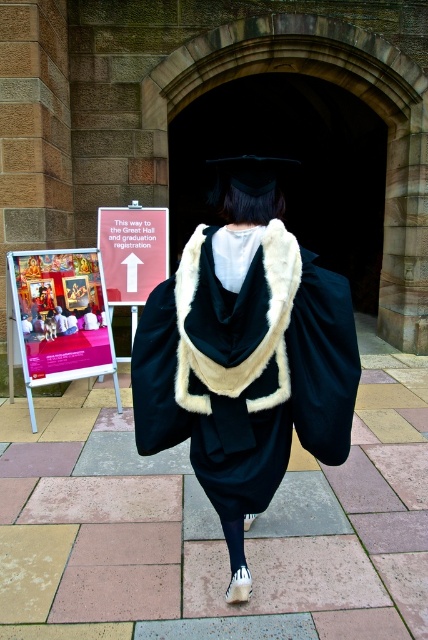
From the picture: Is matte black graduation gown at center above matte pink fabric poster at left?

No.

Who is positioned more to the left, matte black graduation gown at center or matte pink fabric poster at left?

From the viewer's perspective, matte pink fabric poster at left appears more on the left side.

Does point (243, 312) come behind point (30, 269)?

No, it is in front of (30, 269).

The image size is (428, 640). In order to click on matte black graduation gown at center in this screenshot , I will do `click(246, 355)`.

Is matte pink fabric poster at left closer to the viewer compared to white paper sign at center?

Yes, it is in front of white paper sign at center.

Who is shorter, matte pink fabric poster at left or white paper sign at center?

With less height is white paper sign at center.

Which is behind, point (51, 300) or point (121, 280)?

The point (121, 280) is behind.

Find the location of `matte pink fabric poster at left`. matte pink fabric poster at left is located at coordinates (59, 317).

Consider the image. Can you confirm if matte black graduation gown at center is bigger than white paper sign at center?

Indeed, matte black graduation gown at center has a larger size compared to white paper sign at center.

Between point (253, 400) and point (133, 300), which one is positioned behind?

Positioned behind is point (133, 300).

Where is `matte black graduation gown at center`? matte black graduation gown at center is located at coordinates (246, 355).